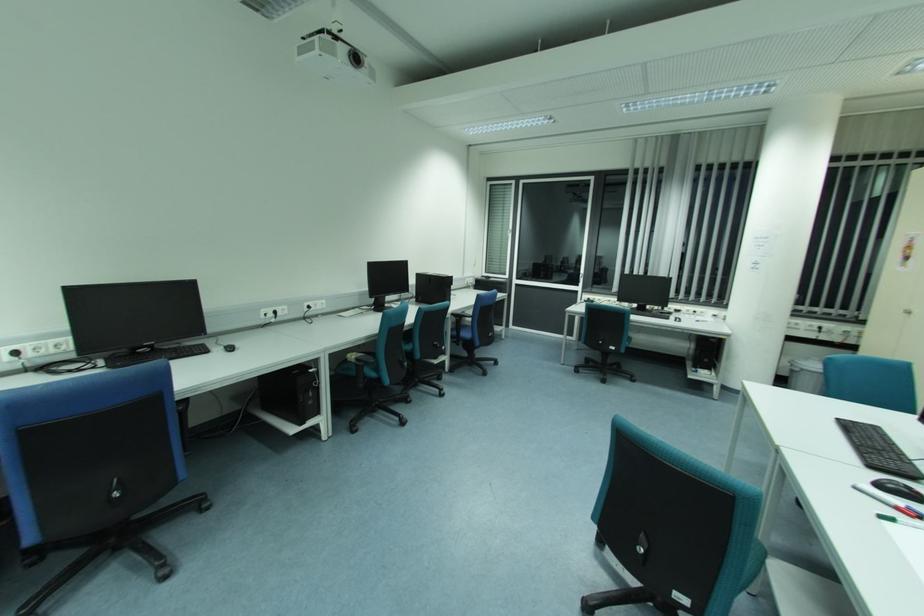
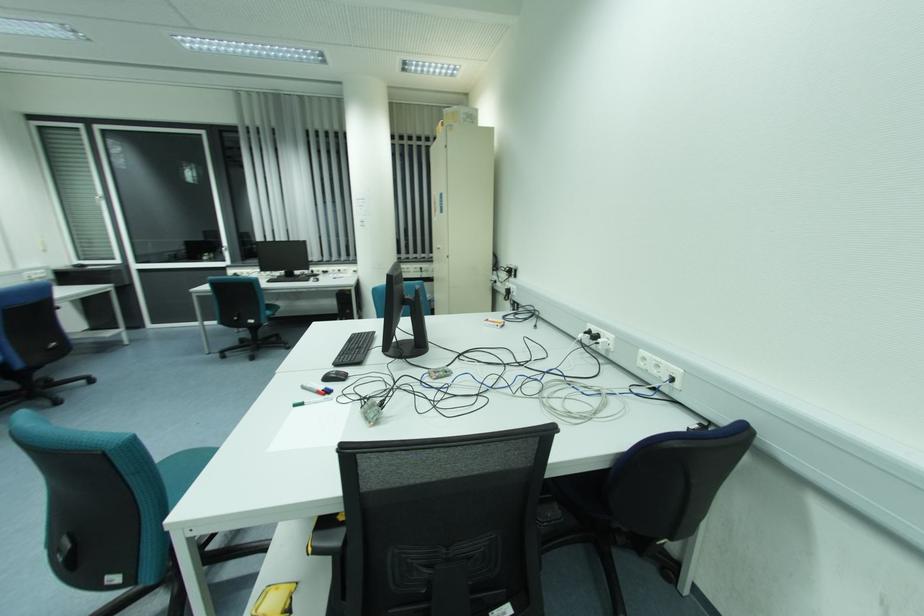
Find the pixel in the second image that matches point (857, 488) in the first image.

(304, 389)